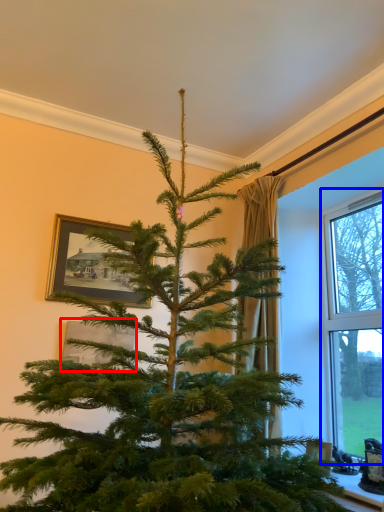
Question: Among these objects, which one is nearest to the camera, picture frame (highlighted by a red box) or window (highlighted by a blue box)?

Choices:
 (A) picture frame
 (B) window

Answer: (B)